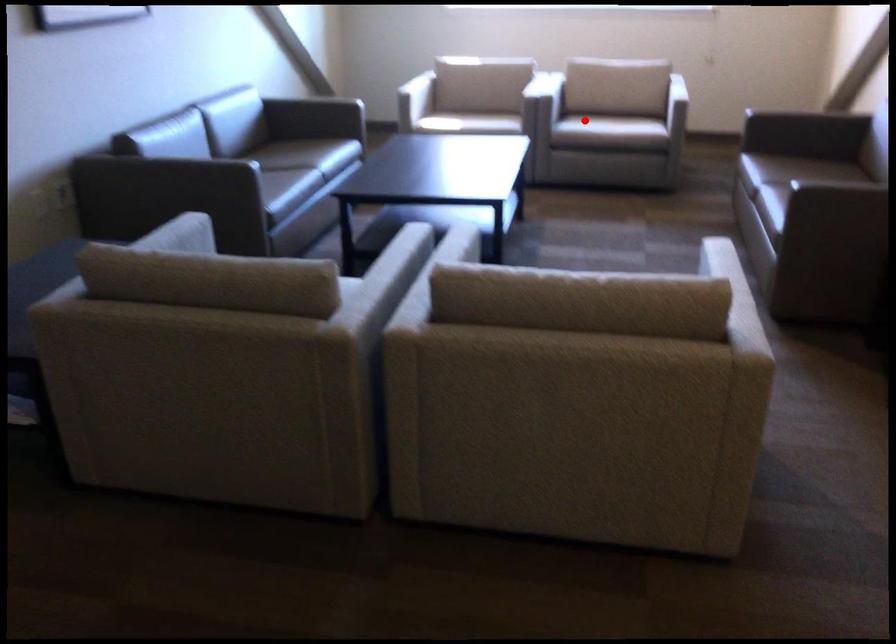
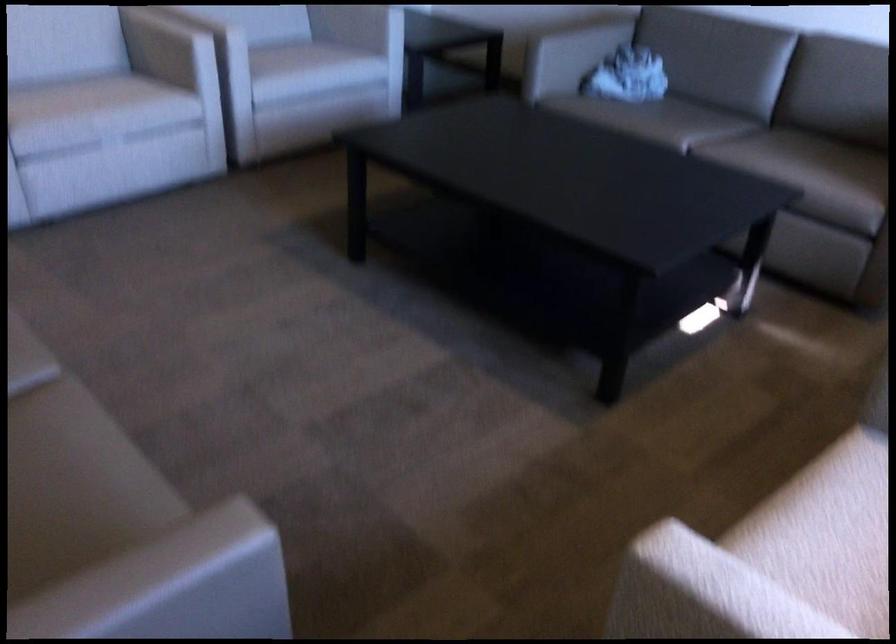
The point at the highlighted location is marked in the first image. Where is the corresponding point in the second image?

(830, 509)